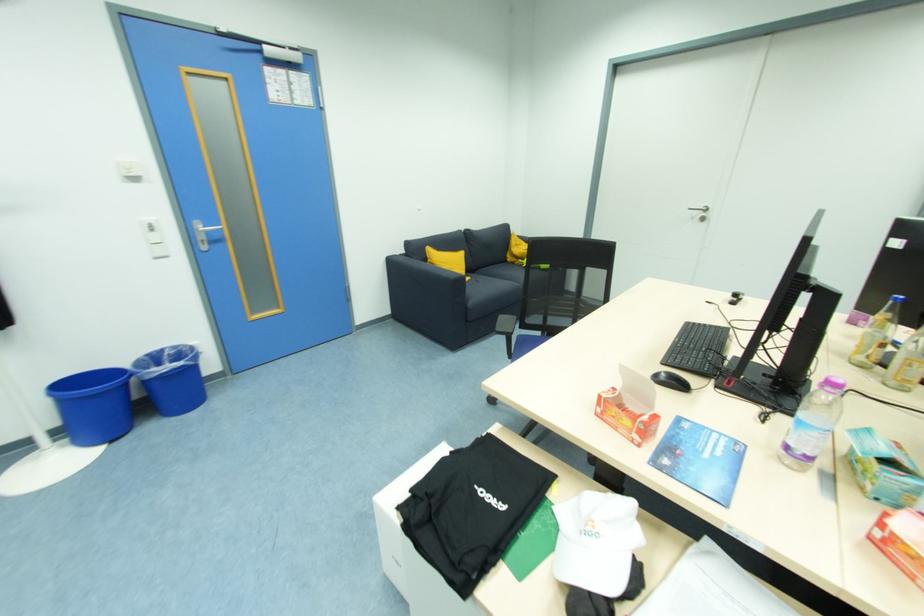
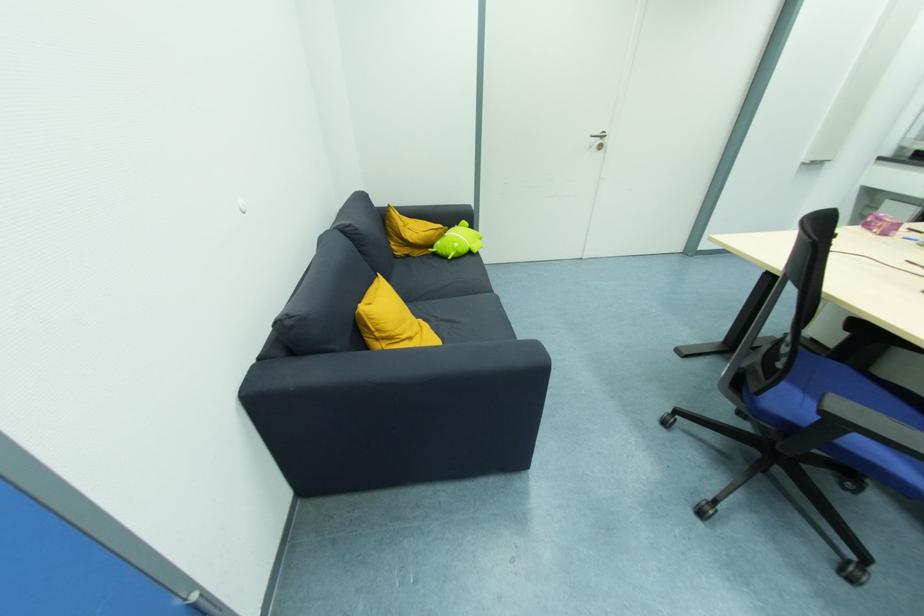
The point at (x=512, y=261) is marked in the first image. Where is the corresponding point in the second image?

(403, 253)